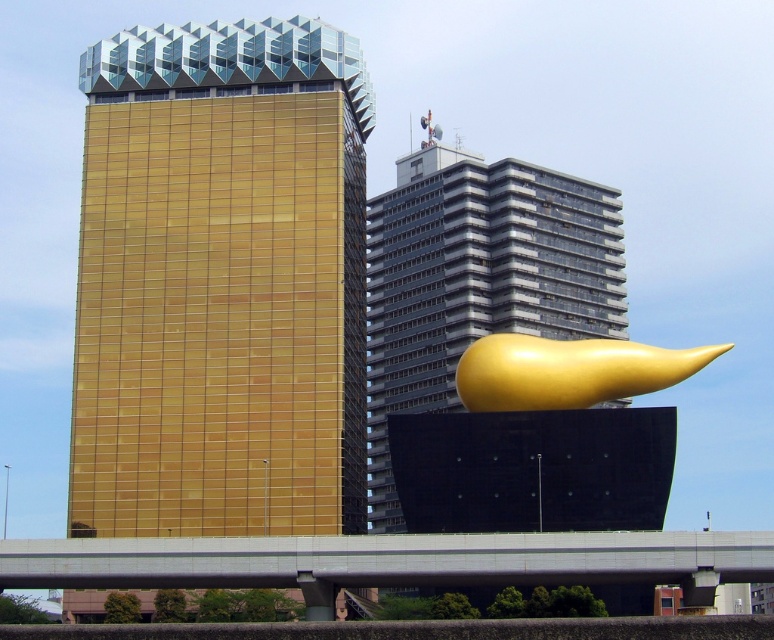
Does gold glass tower at center lie in front of gold polished sculpture at center?

No, gold glass tower at center is behind gold polished sculpture at center.

Which is behind, point (272, 56) or point (567, 403)?

Point (272, 56)

Image resolution: width=774 pixels, height=640 pixels. What are the coordinates of `gold glass tower at center` in the screenshot? It's located at (221, 282).

Which is above, gold glass tower at center or shiny metallic sculpture at center?

gold glass tower at center is higher up.

Does gold glass tower at center come in front of shiny metallic sculpture at center?

Yes, it is in front of shiny metallic sculpture at center.

Is point (343, 276) positioned behind point (437, 179)?

No, (343, 276) is in front of (437, 179).

Locate an element on the screen. gold glass tower at center is located at coordinates (221, 282).

Does point (580, 193) lie in front of point (680, 362)?

No, it is not.

Who is positioned more to the left, shiny metallic sculpture at center or gold polished sculpture at center?

From the viewer's perspective, shiny metallic sculpture at center appears more on the left side.

Find the location of a particular element. shiny metallic sculpture at center is located at coordinates (475, 280).

Identify the location of shiny metallic sculpture at center. This screenshot has height=640, width=774. (475, 280).